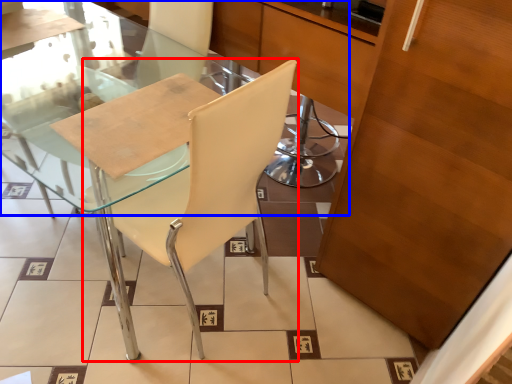
Question: Among these objects, which one is farthest to the camera, chair (highlighted by a red box) or glass table (highlighted by a blue box)?

Choices:
 (A) chair
 (B) glass table

Answer: (B)